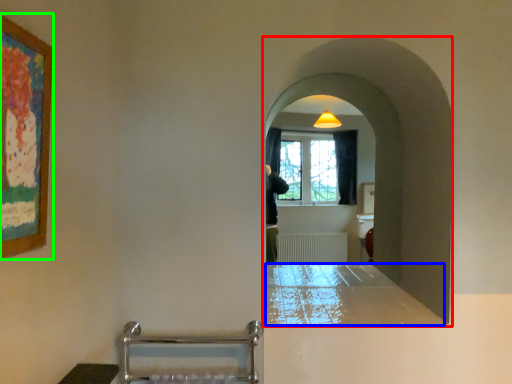
Question: Which is nearer to the passage (highlighted by a red box)? counter top (highlighted by a blue box) or picture frame (highlighted by a green box).

Choices:
 (A) counter top
 (B) picture frame

Answer: (A)